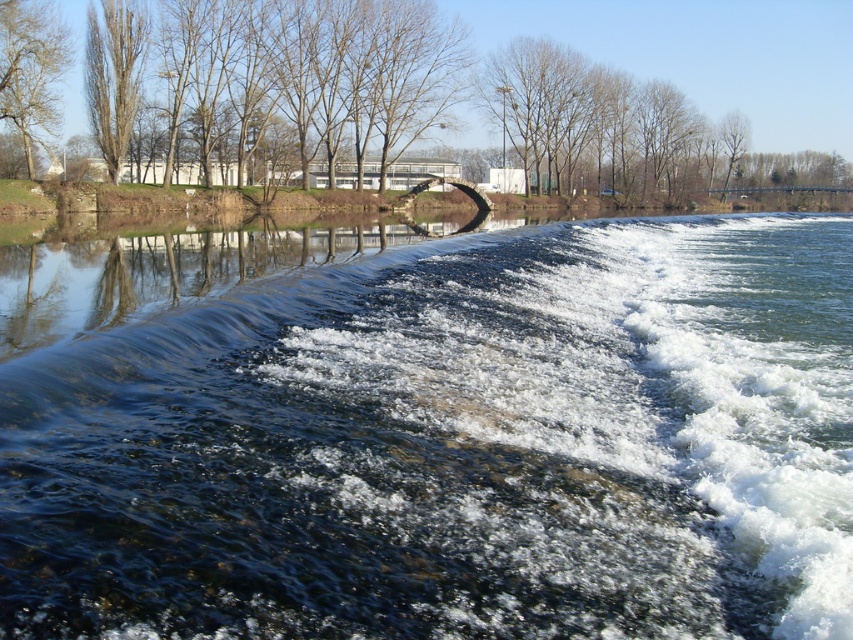
Question: Based on their relative distances, which object is farther from the smooth bark tree at upper left?

Choices:
 (A) brown leafless tree at upper left
 (B) clear water at center

Answer: (B)

Question: Can you confirm if brown leafless tree at upper left is wider than smooth bark tree at upper left?

Choices:
 (A) no
 (B) yes

Answer: (B)

Question: Is clear water at center positioned before smooth bark tree at upper left?

Choices:
 (A) no
 (B) yes

Answer: (B)

Question: Considering the relative positions of brown leafless tree at upper left and smooth bark tree at upper left in the image provided, where is brown leafless tree at upper left located with respect to smooth bark tree at upper left?

Choices:
 (A) below
 (B) above

Answer: (B)

Question: Which point is closer to the camera?

Choices:
 (A) smooth bark tree at upper left
 (B) brown leafless tree at upper left
 (C) clear water at center

Answer: (C)

Question: Which point is closer to the camera taking this photo?

Choices:
 (A) (836, 602)
 (B) (96, 76)
 (C) (0, 38)

Answer: (A)